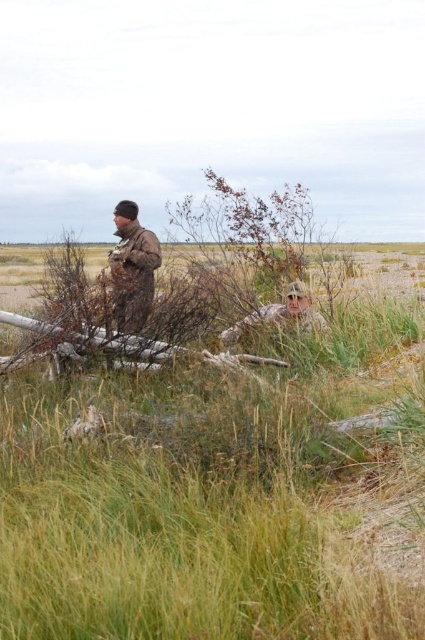
You are standing in the coastal area shown in the image. There is a point at coordinates point (232, 502) that you need to reach. Can you walk directly to it from your current position without any obstacles? Please explain your reasoning.

The point (232, 502) is 3.63 meters away from the viewer. Since the foreground has tall grasses and scattered driftwood, there might be obstacles in the path. However, the description does not explicitly mention any obstacles blocking the direct path to the point. Therefore, it is possible to walk directly to the point unless there are unseen obstacles.

You are a hiker who needs to identify which object is closer to you in the scene. You see the camouflage jacket at left and the camouflage fabric at center. Which one is closer?

The camouflage jacket at left is closer to you because it is in front of the camouflage fabric at center.